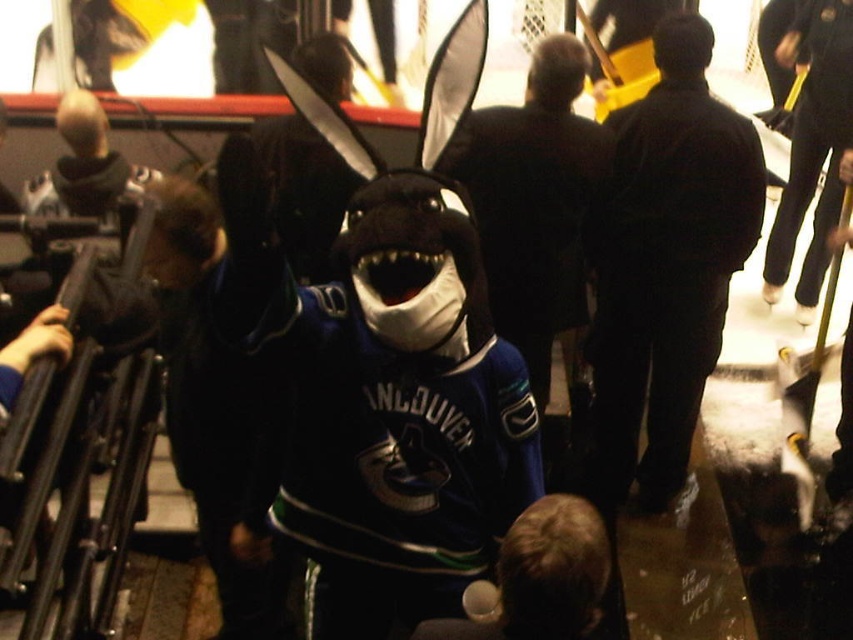
Who is positioned more to the left, velvet plush shark at center or dark blue jacket at center?

From the viewer's perspective, velvet plush shark at center appears more on the left side.

Between velvet plush shark at center and dark blue jacket at center, which one has more height?

dark blue jacket at center

Which is behind, point (335, 435) or point (689, 244)?

Positioned behind is point (689, 244).

Locate an element on the screen. Image resolution: width=853 pixels, height=640 pixels. velvet plush shark at center is located at coordinates (383, 403).

Can you confirm if dark blue jacket at center is smaller than black matte jacket at center?

No.

Does point (663, 20) lie behind point (529, 352)?

No.

Identify the location of dark blue jacket at center. The width and height of the screenshot is (853, 640). coord(666,262).

Is velvet plush shark at center taller than black matte jacket at center?

In fact, velvet plush shark at center may be shorter than black matte jacket at center.

Between velvet plush shark at center and black matte jacket at center, which one has less height?

velvet plush shark at center

Is point (456, 500) farther from viewer compared to point (520, 312)?

No.

Where is `velvet plush shark at center`? The height and width of the screenshot is (640, 853). velvet plush shark at center is located at coordinates (383, 403).